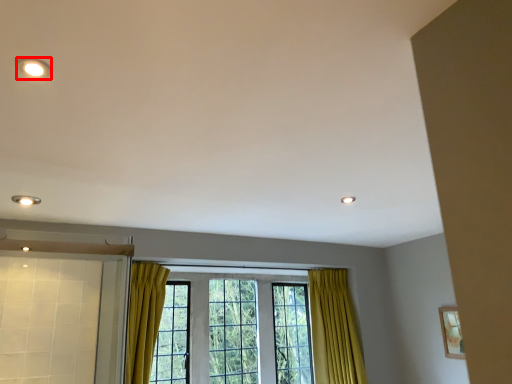
Question: Where is lighting (annotated by the red box) located in relation to window in the image?

Choices:
 (A) right
 (B) left

Answer: (B)